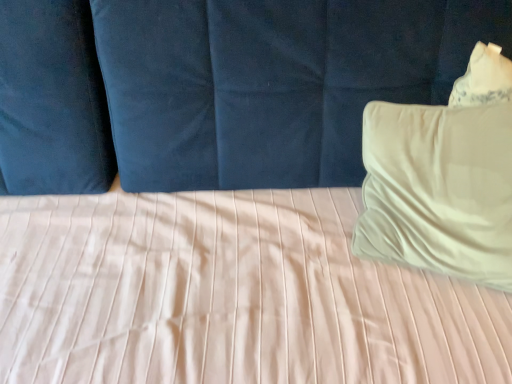
Question: Does beige soft pillow at right have a smaller size compared to matte blue curtain at upper center?

Choices:
 (A) no
 (B) yes

Answer: (B)

Question: From a real-world perspective, is beige soft pillow at right on top of matte blue curtain at upper center?

Choices:
 (A) yes
 (B) no

Answer: (A)

Question: Is beige soft pillow at right in front of matte blue curtain at upper center?

Choices:
 (A) yes
 (B) no

Answer: (B)

Question: Is beige soft pillow at right in contact with matte blue curtain at upper center?

Choices:
 (A) no
 (B) yes

Answer: (A)

Question: From the image's perspective, is beige soft pillow at right under matte blue curtain at upper center?

Choices:
 (A) no
 (B) yes

Answer: (A)

Question: Does beige soft pillow at right appear on the left side of matte blue curtain at upper center?

Choices:
 (A) no
 (B) yes

Answer: (A)

Question: Is matte blue curtain at upper center looking in the opposite direction of beige soft pillow at right?

Choices:
 (A) yes
 (B) no

Answer: (A)

Question: From the image's perspective, does matte blue curtain at upper center appear lower than beige soft pillow at right?

Choices:
 (A) yes
 (B) no

Answer: (A)

Question: Can you confirm if matte blue curtain at upper center is smaller than beige soft pillow at right?

Choices:
 (A) yes
 (B) no

Answer: (B)

Question: Is matte blue curtain at upper center outside beige soft pillow at right?

Choices:
 (A) yes
 (B) no

Answer: (A)

Question: Is matte blue curtain at upper center further to camera compared to beige soft pillow at right?

Choices:
 (A) yes
 (B) no

Answer: (B)

Question: Considering the relative sizes of matte blue curtain at upper center and beige soft pillow at right in the image provided, is matte blue curtain at upper center shorter than beige soft pillow at right?

Choices:
 (A) no
 (B) yes

Answer: (A)

Question: From the image's perspective, is beige soft pillow at right located above or below matte blue curtain at upper center?

Choices:
 (A) below
 (B) above

Answer: (B)